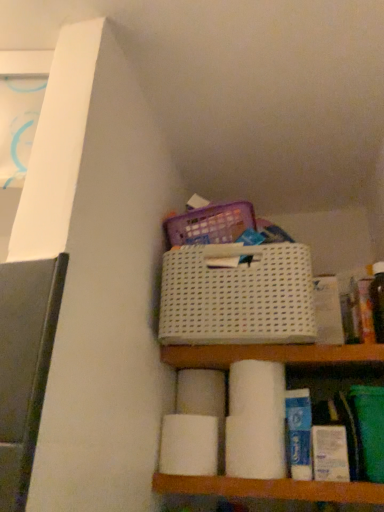
Question: From the image's perspective, is white matte toilet paper at center, the first toilet paper when ordered from front to back, above white matte toilet paper at center, the 2th toilet paper from the front?

Choices:
 (A) yes
 (B) no

Answer: (A)

Question: Considering the relative sizes of white matte toilet paper at center, the first toilet paper when ordered from front to back, and white matte toilet paper at center, which is the 2th toilet paper in back-to-front order, in the image provided, is white matte toilet paper at center, the first toilet paper when ordered from front to back, shorter than white matte toilet paper at center, which is the 2th toilet paper in back-to-front order,?

Choices:
 (A) yes
 (B) no

Answer: (B)

Question: Does white matte toilet paper at center, which is the third toilet paper in back-to-front order, have a lesser width compared to white matte toilet paper at center, which is the 2th toilet paper in back-to-front order?

Choices:
 (A) no
 (B) yes

Answer: (B)

Question: From the image's perspective, would you say white matte toilet paper at center, which is the third toilet paper in back-to-front order, is shown under white matte toilet paper at center, which is the 2th toilet paper in back-to-front order?

Choices:
 (A) no
 (B) yes

Answer: (A)

Question: Can you confirm if white matte toilet paper at center, which is the third toilet paper in back-to-front order, is wider than white matte toilet paper at center, which is the 2th toilet paper in back-to-front order?

Choices:
 (A) no
 (B) yes

Answer: (A)

Question: Is white matte toilet paper at center, which is the 2th toilet paper in back-to-front order, in front of or behind white mesh basket at center in the image?

Choices:
 (A) front
 (B) behind

Answer: (B)

Question: Considering the positions of white matte toilet paper at center, the 2th toilet paper from the front, and white mesh basket at center in the image, is white matte toilet paper at center, the 2th toilet paper from the front, wider or thinner than white mesh basket at center?

Choices:
 (A) wide
 (B) thin

Answer: (B)

Question: Would you say white matte toilet paper at center, which is the 2th toilet paper in back-to-front order, is to the left or to the right of white mesh basket at center in the picture?

Choices:
 (A) right
 (B) left

Answer: (B)

Question: Is white matte toilet paper at center, which is the 2th toilet paper in back-to-front order, situated inside white mesh basket at center or outside?

Choices:
 (A) inside
 (B) outside

Answer: (B)

Question: In terms of height, does white matte toilet paper at lower center, arranged as the first toilet paper when viewed from the back, look taller or shorter compared to white matte toilet paper at center, which is the third toilet paper in back-to-front order?

Choices:
 (A) short
 (B) tall

Answer: (A)

Question: From the image's perspective, is white matte toilet paper at lower center, arranged as the first toilet paper when viewed from the back, located above or below white matte toilet paper at center, the first toilet paper when ordered from front to back?

Choices:
 (A) below
 (B) above

Answer: (B)

Question: Relative to white matte toilet paper at center, the first toilet paper when ordered from front to back, is white matte toilet paper at lower center, the third toilet paper when ordered from front to back, in front or behind?

Choices:
 (A) behind
 (B) front

Answer: (A)

Question: From a real-world perspective, is white matte toilet paper at lower center, arranged as the first toilet paper when viewed from the back, positioned above or below white matte toilet paper at center, which is the third toilet paper in back-to-front order?

Choices:
 (A) above
 (B) below

Answer: (A)

Question: Would you say white mesh basket at center is inside or outside white matte toilet paper at center, the 2th toilet paper from the front?

Choices:
 (A) outside
 (B) inside

Answer: (A)

Question: From a real-world perspective, is white mesh basket at center positioned above or below white matte toilet paper at center, which is the 2th toilet paper in back-to-front order?

Choices:
 (A) below
 (B) above

Answer: (B)